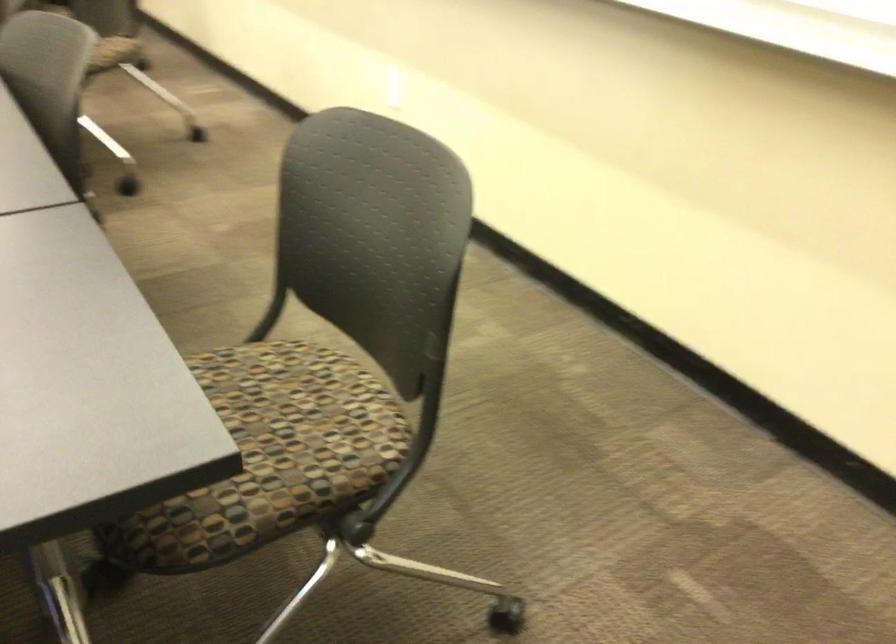
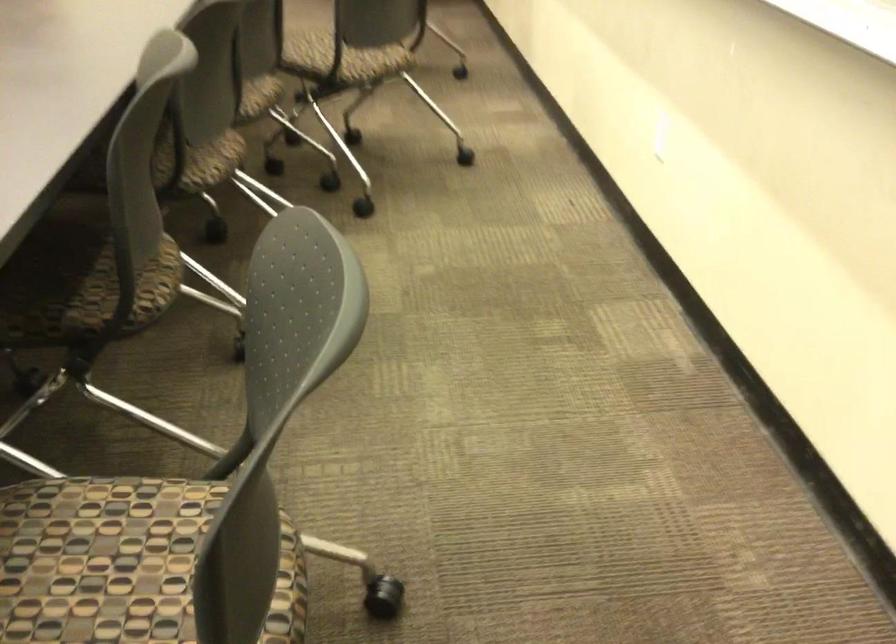
Question: The camera is either moving clockwise (left) or counter-clockwise (right) around the object. The first image is from the beginning of the video and the second image is from the end. Is the camera moving left or right when shooting the video?

Choices:
 (A) Left
 (B) Right

Answer: (B)